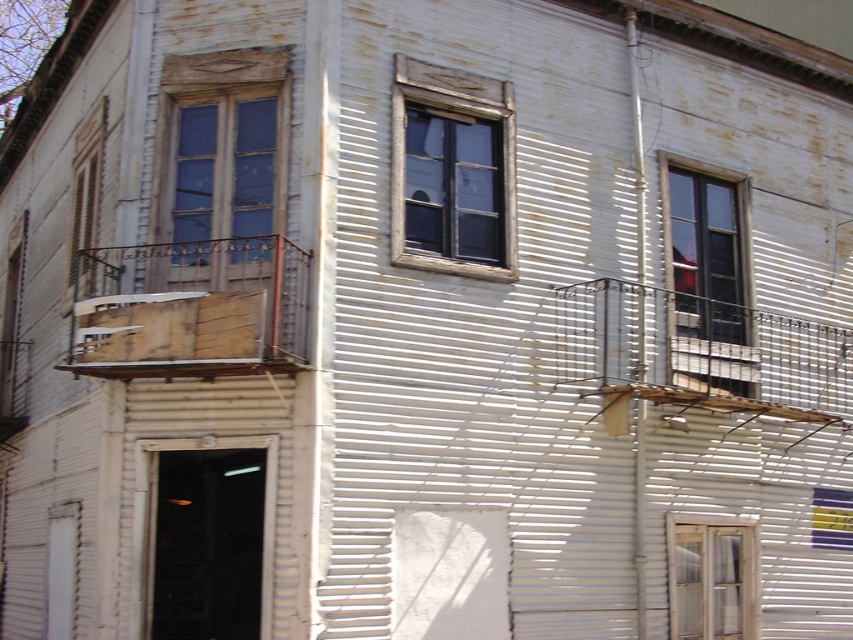
You are an architect assessing the building facade. You need to determine which of the two elements, the wooden frame at upper left or the matte glass window at upper right, requires more structural support due to its height. Based on the scene, which one should you prioritize?

The matte glass window at upper right is taller than the wooden frame at upper left, so it requires more structural support and should be prioritized.

Consider the image. You are standing in front of the building and want to locate the wooden frame at upper left. Where would you look relative to the building?

The wooden frame at upper left is located at the point with coordinates 0.266 on the x axis and 0.260 on the y axis relative to the building.

You are standing in front of the building and want to enter through the wooden frame window at lower right. However, there is a wooden frame at center blocking your path. Can you walk around it to reach the window?

The wooden frame at center is above the wooden frame window at lower right, so you can walk around it to reach the window since it is not blocking your path horizontally.